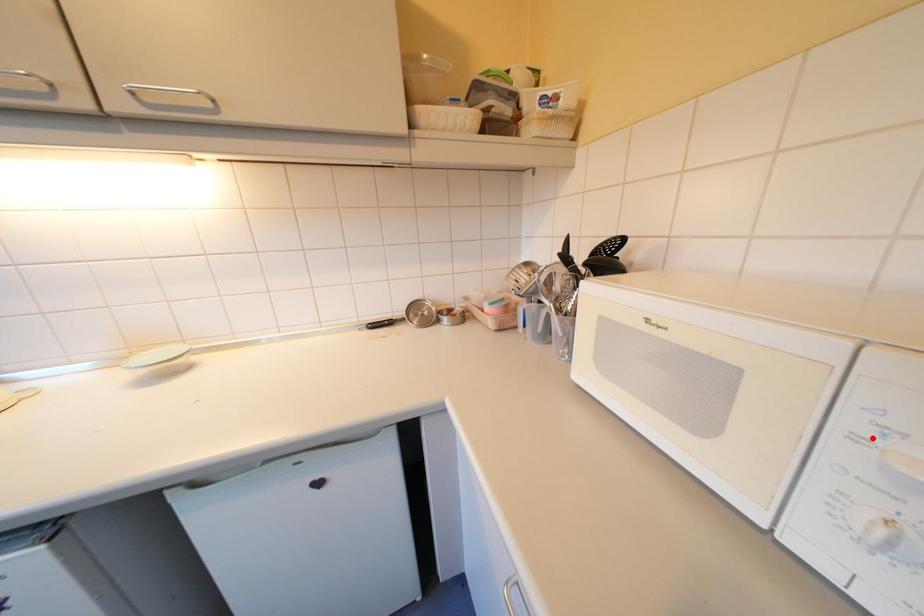
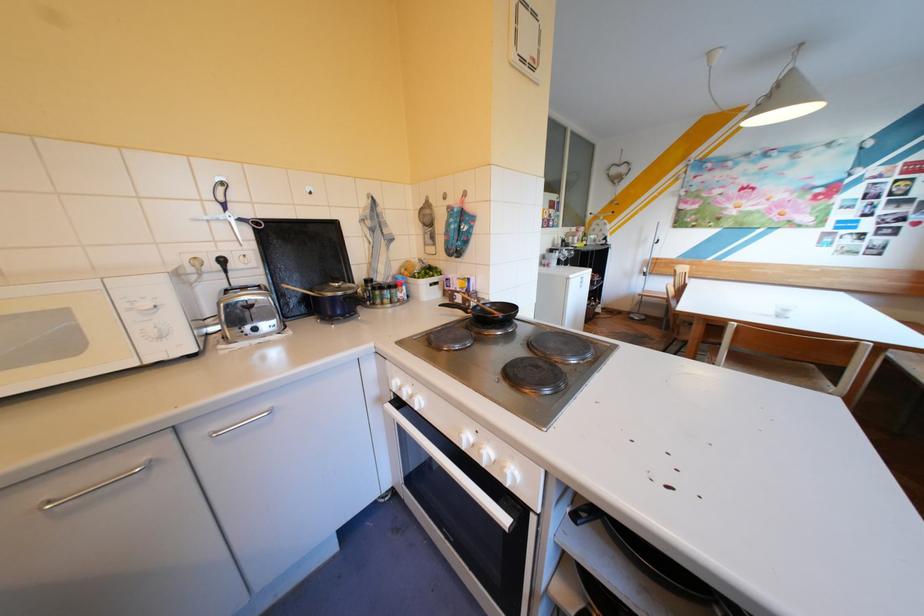
In the second image, find the point that corresponds to the highlighted location in the first image.

(142, 309)